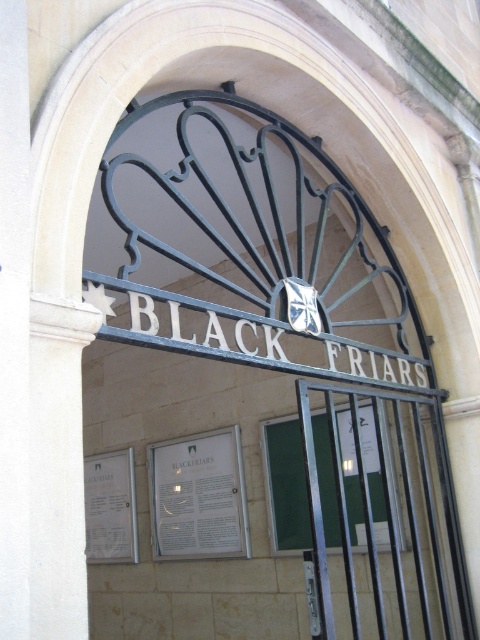
Question: Among these objects, which one is nearest to the camera?

Choices:
 (A) white paper sign at center
 (B) black metal gate at center
 (C) white paper sign at lower left

Answer: (B)

Question: Can you confirm if black metal gate at center is smaller than white paper sign at center?

Choices:
 (A) yes
 (B) no

Answer: (B)

Question: Which point appears closest to the camera in this image?

Choices:
 (A) (119, 506)
 (B) (186, 500)

Answer: (B)

Question: Among these objects, which one is nearest to the camera?

Choices:
 (A) white paper sign at lower left
 (B) black metal gate at center
 (C) white paper sign at center

Answer: (B)

Question: Does black metal gate at center have a smaller size compared to white paper sign at center?

Choices:
 (A) no
 (B) yes

Answer: (A)

Question: Does black metal gate at center appear on the left side of white paper sign at center?

Choices:
 (A) no
 (B) yes

Answer: (A)